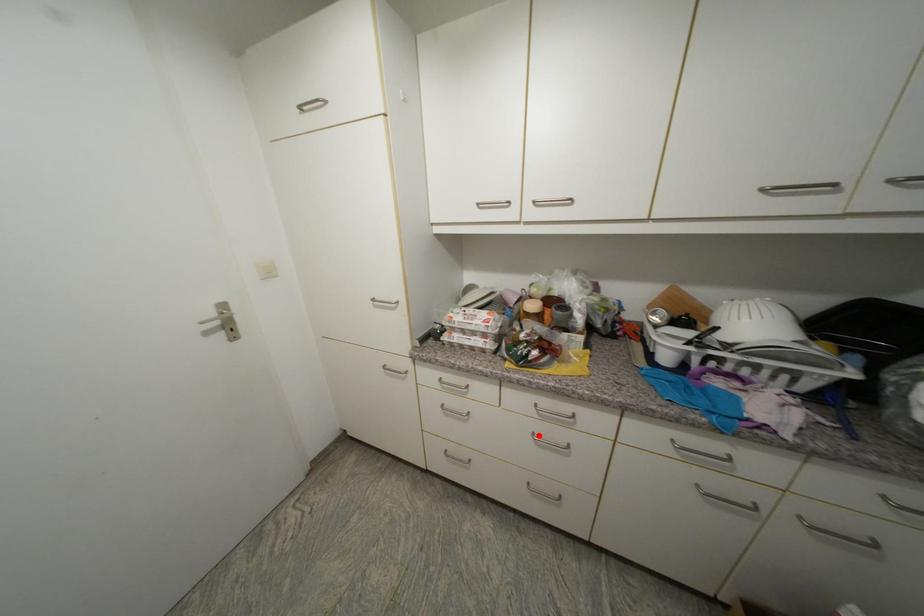
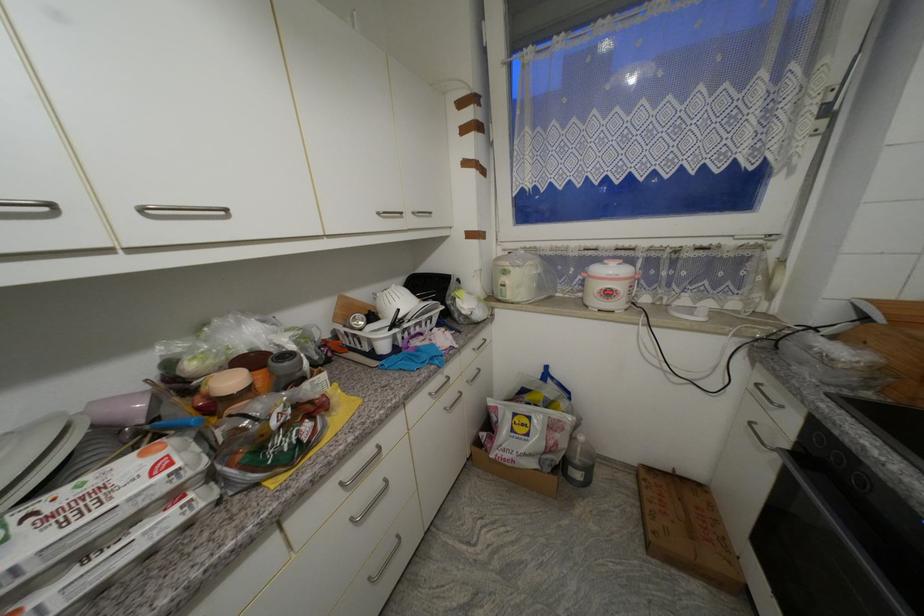
The point at the highlighted location is marked in the first image. Where is the corresponding point in the second image?

(358, 521)